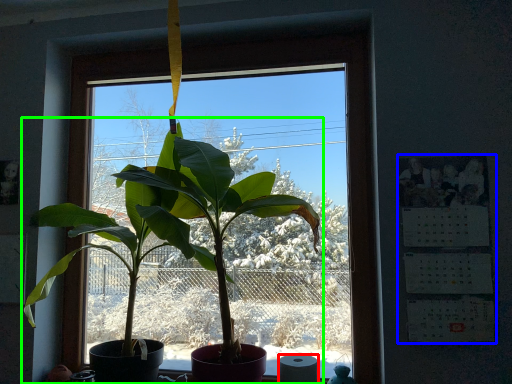
Question: Which object is positioned closest to toilet paper (highlighted by a red box)? Select from bulletin board (highlighted by a blue box) and houseplant (highlighted by a green box).

Choices:
 (A) bulletin board
 (B) houseplant

Answer: (A)